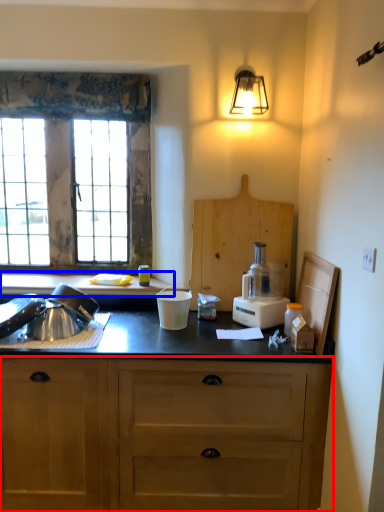
Question: Which object appears closest to the camera in this image, cabinetry (highlighted by a red box) or countertop (highlighted by a blue box)?

Choices:
 (A) cabinetry
 (B) countertop

Answer: (A)